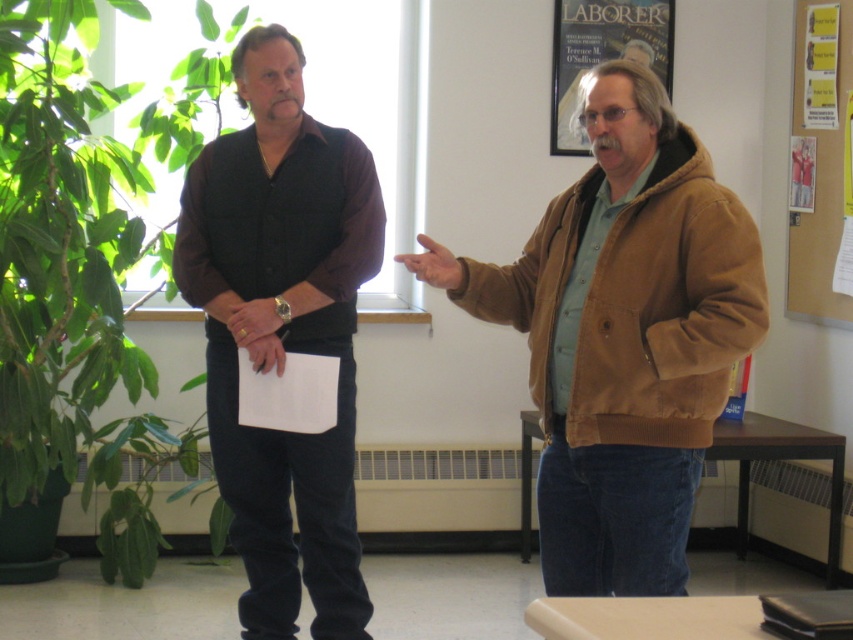
Question: Is brown suede jacket at right closer to camera compared to black matte vest at left?

Choices:
 (A) no
 (B) yes

Answer: (B)

Question: Which point is farther to the camera?

Choices:
 (A) (84, 221)
 (B) (821, 156)

Answer: (B)

Question: Considering the relative positions of brown suede jacket at right and green leafy plant at left in the image provided, where is brown suede jacket at right located with respect to green leafy plant at left?

Choices:
 (A) above
 (B) below

Answer: (B)

Question: Among these objects, which one is nearest to the camera?

Choices:
 (A) corkboard at right
 (B) green leafy plant at left
 (C) brown suede jacket at right
 (D) black matte vest at left

Answer: (C)

Question: Which of the following is the closest to the observer?

Choices:
 (A) green leafy plant at left
 (B) brown suede jacket at right
 (C) black matte vest at left

Answer: (B)

Question: Is green leafy plant at left to the left of black matte vest at left from the viewer's perspective?

Choices:
 (A) yes
 (B) no

Answer: (A)